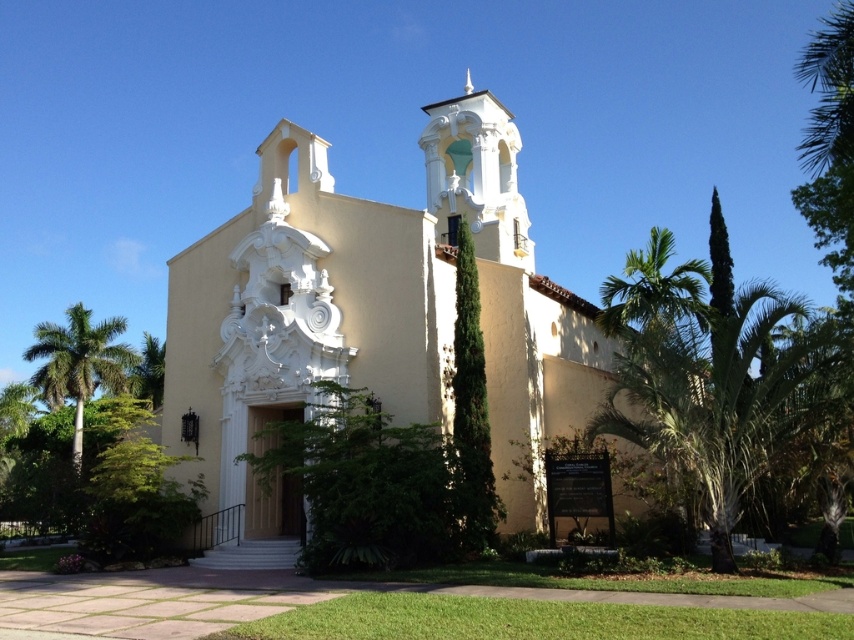
Question: Based on their relative distances, which object is nearer to the white ornate bell tower at upper center?

Choices:
 (A) beige stucco church at center
 (B) green leafy palm tree at right

Answer: (A)

Question: Can you confirm if green leafy palm tree at right is positioned to the left of white ornate bell tower at upper center?

Choices:
 (A) no
 (B) yes

Answer: (A)

Question: Which point appears closest to the camera in this image?

Choices:
 (A) (72, 348)
 (B) (822, 376)
 (C) (385, 228)
 (D) (500, 259)

Answer: (B)

Question: Which is nearer to the white ornate bell tower at upper center?

Choices:
 (A) green leafy palm tree at left
 (B) green leafy palm tree at right

Answer: (B)

Question: Is beige stucco church at center positioned before green leafy palm tree at left?

Choices:
 (A) yes
 (B) no

Answer: (A)

Question: Is beige stucco church at center further to the viewer compared to green leafy palm tree at right?

Choices:
 (A) yes
 (B) no

Answer: (A)